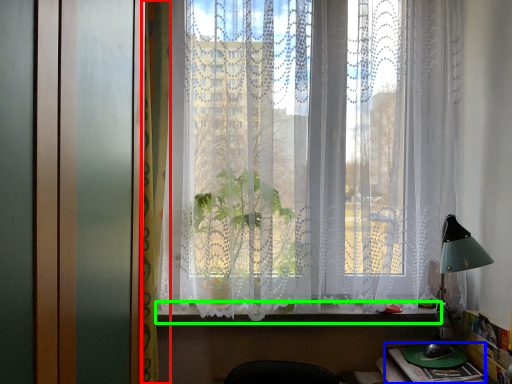
Question: Considering the real-world distances, which object is farthest from curtain (highlighted by a red box)? book (highlighted by a blue box) or window sill (highlighted by a green box)?

Choices:
 (A) book
 (B) window sill

Answer: (A)